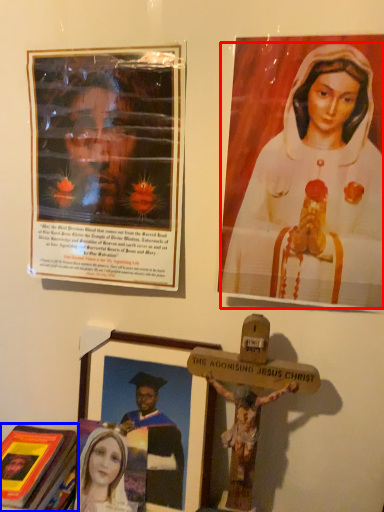
Question: Among these objects, which one is farthest to the camera, woman (highlighted by a red box) or book (highlighted by a blue box)?

Choices:
 (A) woman
 (B) book

Answer: (B)